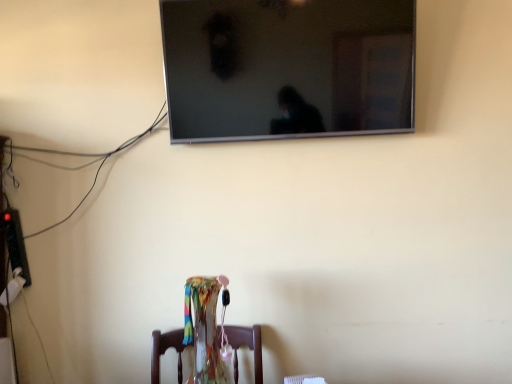
Question: Is transparent glass vase at center taller than flat screen tv at upper center?

Choices:
 (A) no
 (B) yes

Answer: (A)

Question: Is transparent glass vase at center outside flat screen tv at upper center?

Choices:
 (A) yes
 (B) no

Answer: (A)

Question: Does transparent glass vase at center have a larger size compared to flat screen tv at upper center?

Choices:
 (A) no
 (B) yes

Answer: (A)

Question: Is transparent glass vase at center closer to camera compared to flat screen tv at upper center?

Choices:
 (A) no
 (B) yes

Answer: (B)

Question: Considering the relative positions of transparent glass vase at center and flat screen tv at upper center in the image provided, is transparent glass vase at center to the left of flat screen tv at upper center from the viewer's perspective?

Choices:
 (A) no
 (B) yes

Answer: (B)

Question: Does transparent glass vase at center lie behind flat screen tv at upper center?

Choices:
 (A) yes
 (B) no

Answer: (B)

Question: Does flat screen tv at upper center have a greater height compared to transparent glass vase at center?

Choices:
 (A) no
 (B) yes

Answer: (B)

Question: Is flat screen tv at upper center behind transparent glass vase at center?

Choices:
 (A) yes
 (B) no

Answer: (A)

Question: From a real-world perspective, is flat screen tv at upper center below transparent glass vase at center?

Choices:
 (A) no
 (B) yes

Answer: (A)

Question: Is flat screen tv at upper center closer to camera compared to transparent glass vase at center?

Choices:
 (A) yes
 (B) no

Answer: (B)

Question: Is flat screen tv at upper center positioned with its back to transparent glass vase at center?

Choices:
 (A) yes
 (B) no

Answer: (B)

Question: Does flat screen tv at upper center have a smaller size compared to transparent glass vase at center?

Choices:
 (A) no
 (B) yes

Answer: (A)

Question: In terms of height, does transparent glass vase at center look taller or shorter compared to flat screen tv at upper center?

Choices:
 (A) tall
 (B) short

Answer: (B)